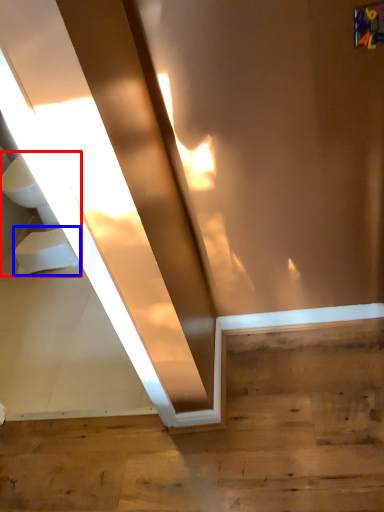
Question: Which object is closer to the camera taking this photo, sink (highlighted by a red box) or toilet bowl (highlighted by a blue box)?

Choices:
 (A) sink
 (B) toilet bowl

Answer: (B)